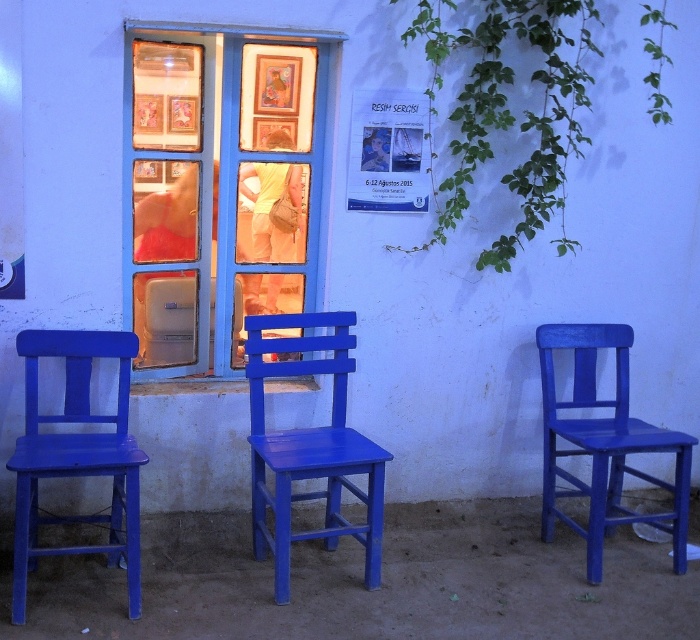
Question: Which of the following is the farthest from the observer?

Choices:
 (A) (312, 458)
 (B) (364, 122)
 (C) (134, 493)

Answer: (B)

Question: Which point is closer to the camera?

Choices:
 (A) matte blue chair at right
 (B) blue painted wood window at center
 (C) matte wood chair at left
 (D) matte wood chair at center

Answer: (C)

Question: Does matte wood chair at left lie behind matte blue chair at right?

Choices:
 (A) yes
 (B) no

Answer: (B)

Question: Is matte blue chair at right thinner than matte paper poster at center?

Choices:
 (A) yes
 (B) no

Answer: (B)

Question: Does matte blue chair at right appear on the right side of matte paper poster at center?

Choices:
 (A) no
 (B) yes

Answer: (B)

Question: Which of these objects is positioned farthest from the matte blue chair at right?

Choices:
 (A) matte wood chair at center
 (B) matte paper poster at center
 (C) matte wood chair at left

Answer: (C)